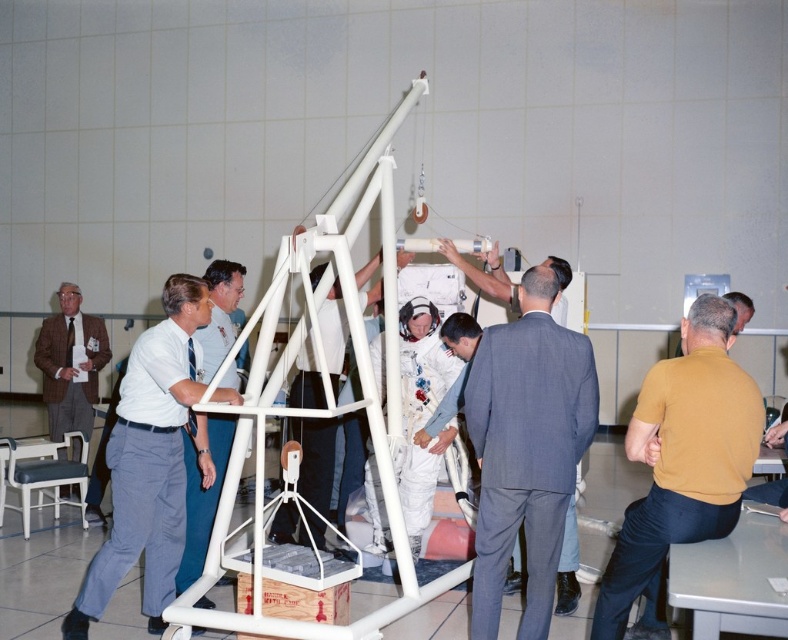
How distant is white shirt at left from matte brown suit at left?

2.23 meters

Which is below, white shirt at left or matte brown suit at left?

Positioned lower is white shirt at left.

Which is behind, point (199, 426) or point (71, 353)?

Positioned behind is point (71, 353).

This screenshot has width=788, height=640. I want to click on white shirt at left, so click(x=203, y=492).

Can you confirm if gray suit at center is positioned to the left of white plastic ladder at center?

In fact, gray suit at center is to the right of white plastic ladder at center.

Which is more to the right, gray suit at center or white plastic ladder at center?

Positioned to the right is gray suit at center.

Between point (530, 317) and point (140, 400), which one is positioned behind?

Point (140, 400)

In order to click on gray suit at center in this screenshot , I will do `click(526, 449)`.

Does yellow t-shirt at right have a greater width compared to matte brown suit at left?

In fact, yellow t-shirt at right might be narrower than matte brown suit at left.

What are the coordinates of `yellow t-shirt at right` in the screenshot? It's located at (681, 465).

Which is behind, point (638, 577) or point (58, 435)?

Positioned behind is point (58, 435).

Image resolution: width=788 pixels, height=640 pixels. In order to click on yellow t-shirt at right in this screenshot , I will do `click(681, 465)`.